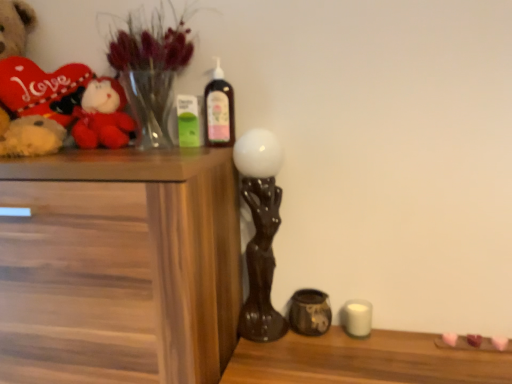
Identify the location of vacant area that is in front of translucent plastic bottle at upper center. (208, 152).